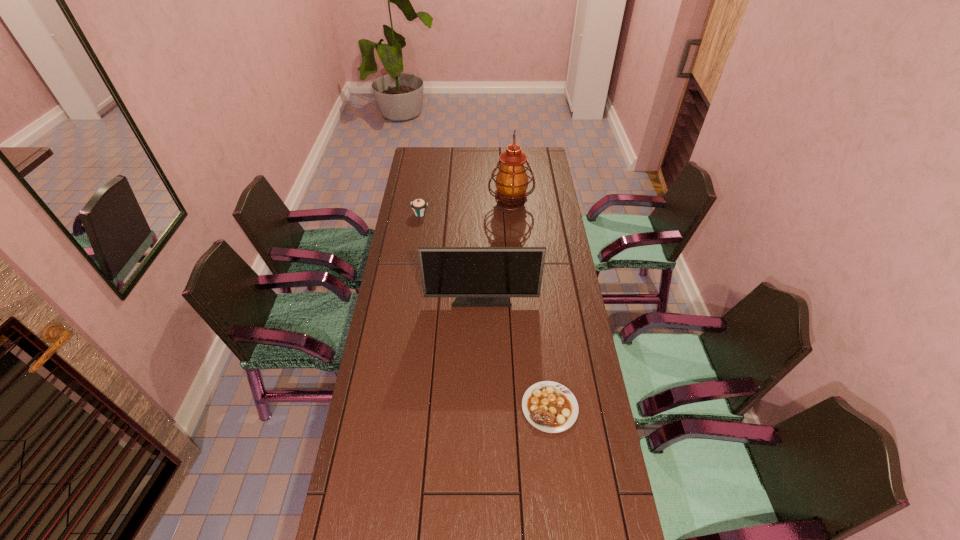
Find the location of a particular element. vacant area situated on the left of the steak is located at coordinates (455, 407).

I want to click on monitor that is at the left edge, so click(x=478, y=276).

Identify the location of cupcake at the left edge. (419, 206).

The height and width of the screenshot is (540, 960). I want to click on oil lamp located at the right edge, so click(511, 182).

The height and width of the screenshot is (540, 960). I want to click on monitor at the right edge, so click(478, 276).

Where is `steak at the right edge`? Image resolution: width=960 pixels, height=540 pixels. steak at the right edge is located at coordinates (551, 407).

The width and height of the screenshot is (960, 540). In the image, there is a desktop. What are the coordinates of `vacant space at the far edge` in the screenshot? It's located at (505, 147).

Find the location of a particular element. free space at the left edge of the desktop is located at coordinates (355, 536).

The image size is (960, 540). In order to click on free space at the right edge of the desktop in this screenshot , I will do `click(598, 508)`.

Where is `vacant area at the far left corner`? Image resolution: width=960 pixels, height=540 pixels. vacant area at the far left corner is located at coordinates pos(429,157).